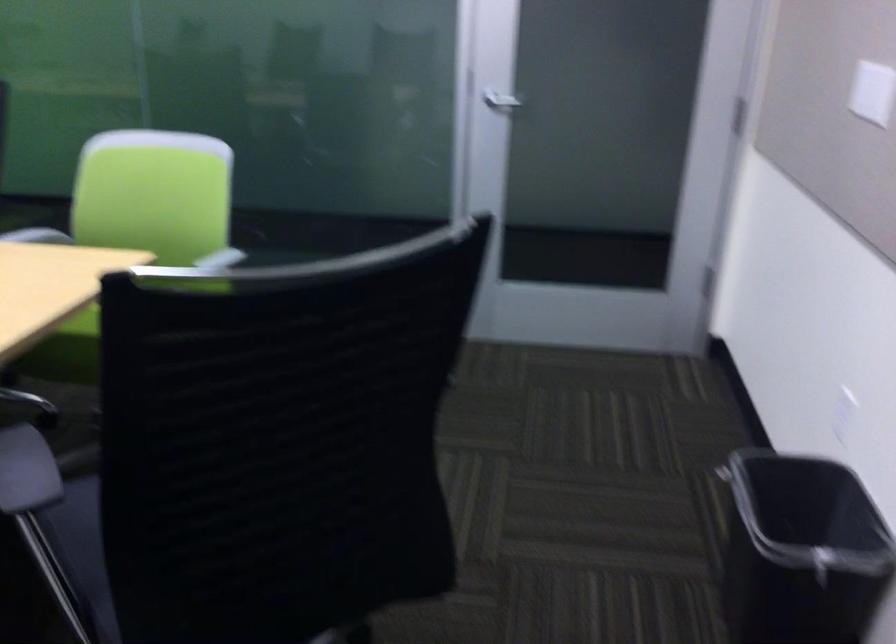
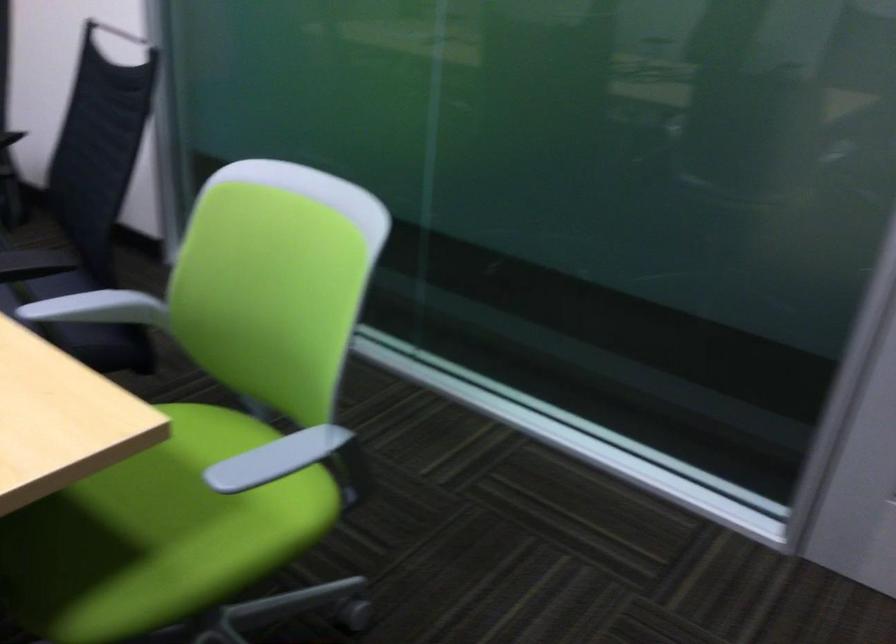
In the second image, find the point that corresponds to (x=225, y=254) in the first image.

(276, 458)